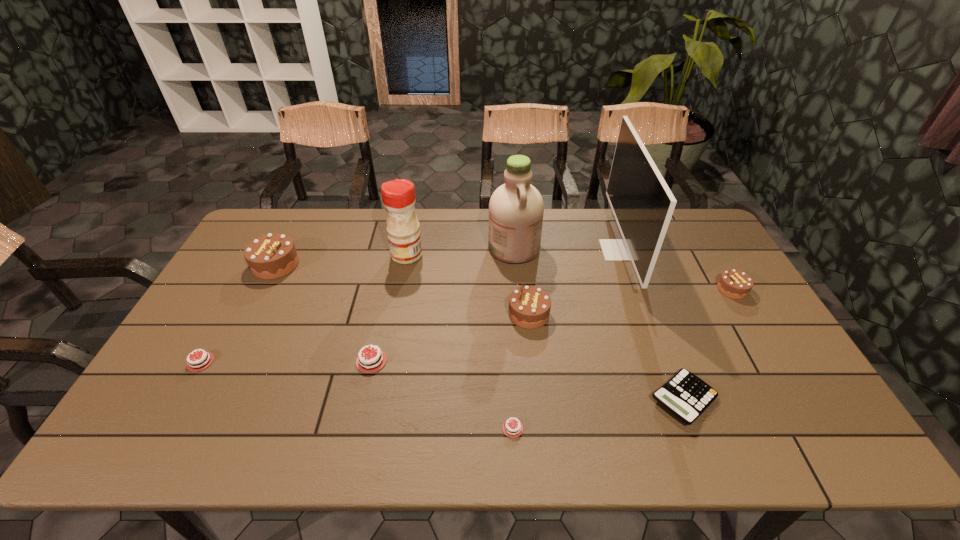
The height and width of the screenshot is (540, 960). What are the coordinates of `vacant space located on the right of the smallest red chocolate cake` in the screenshot? It's located at (671, 428).

I want to click on monitor at the far edge, so click(x=642, y=203).

Locate an element on the screen. Image resolution: width=960 pixels, height=540 pixels. cleansing agent that is at the far edge is located at coordinates (516, 208).

Image resolution: width=960 pixels, height=540 pixels. What are the coordinates of `condiment present at the far edge` in the screenshot? It's located at (403, 228).

At what (x,y) coordinates should I click in order to perform the action: click on calculator that is at the near edge. Please return your answer as a coordinate pair (x, y). This screenshot has width=960, height=540. Looking at the image, I should click on (685, 395).

You are a GUI agent. You are given a task and a screenshot of the screen. Output one action in this format:
    pyautogui.click(x=<x>, y=<y>)
    Task: Click on the chocolate cake situated at the near edge
    This screenshot has width=960, height=540.
    Given the screenshot: What is the action you would take?
    pyautogui.click(x=512, y=428)

Locate an element on the screen. object that is at the right edge is located at coordinates (734, 284).

Locate an element on the screen. free spot at the far edge of the desktop is located at coordinates (485, 233).

In the image, there is a desktop. Where is `vacant space at the near edge`? Image resolution: width=960 pixels, height=540 pixels. vacant space at the near edge is located at coordinates (377, 441).

This screenshot has width=960, height=540. In the image, there is a desktop. What are the coordinates of `vacant space at the left edge` in the screenshot? It's located at (228, 292).